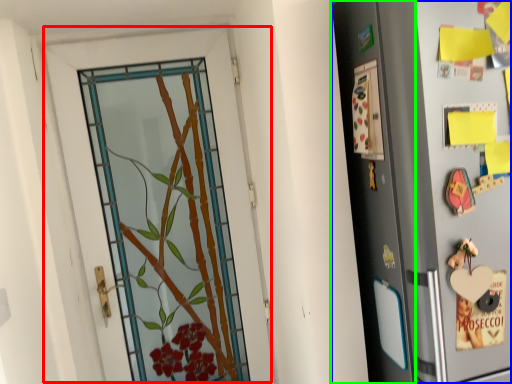
Question: Which object is positioned farthest from door (highlighted by a red box)? Select from refrigerator (highlighted by a blue box) and screen door (highlighted by a green box).

Choices:
 (A) refrigerator
 (B) screen door

Answer: (A)